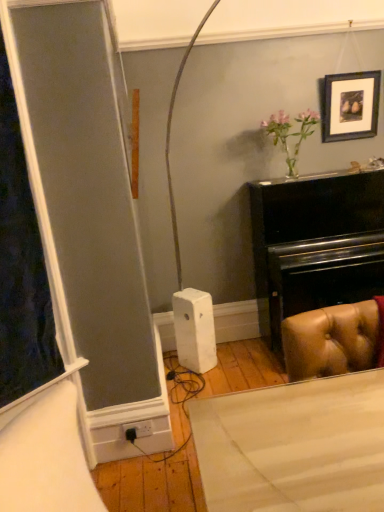
Locate an element on the screen. The width and height of the screenshot is (384, 512). empty space that is ontop of wooden picture frame at upper right (from a real-world perspective) is located at coordinates (347, 74).